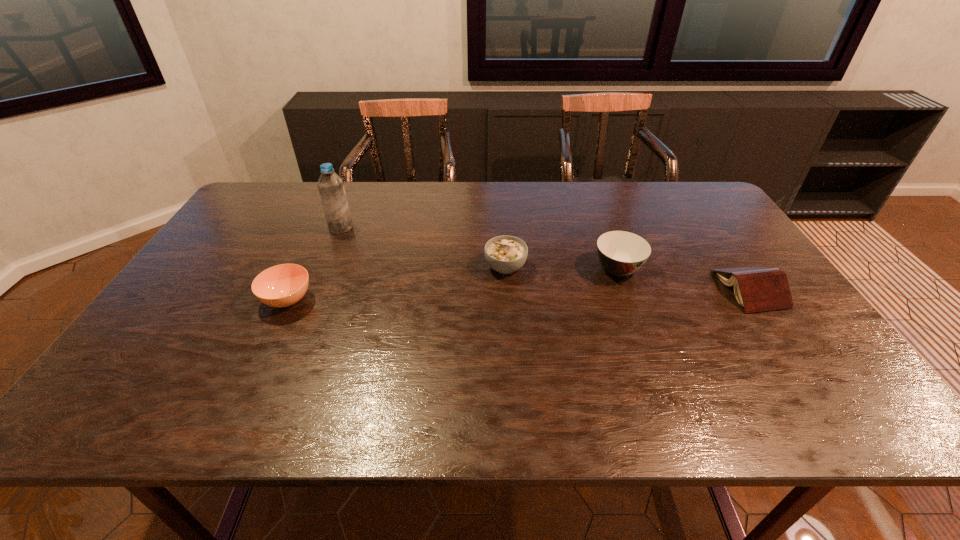
Identify the location of vacant point that satisfies the following two spatial constraints: 1. on the back side of the leftmost soup bowl; 2. on the right side of the rightmost object. (293, 289).

Find the location of a particular element. Image resolution: width=960 pixels, height=540 pixels. vacant area in the image that satisfies the following two spatial constraints: 1. on the back side of the book; 2. on the right side of the leftmost soup bowl is located at coordinates (293, 289).